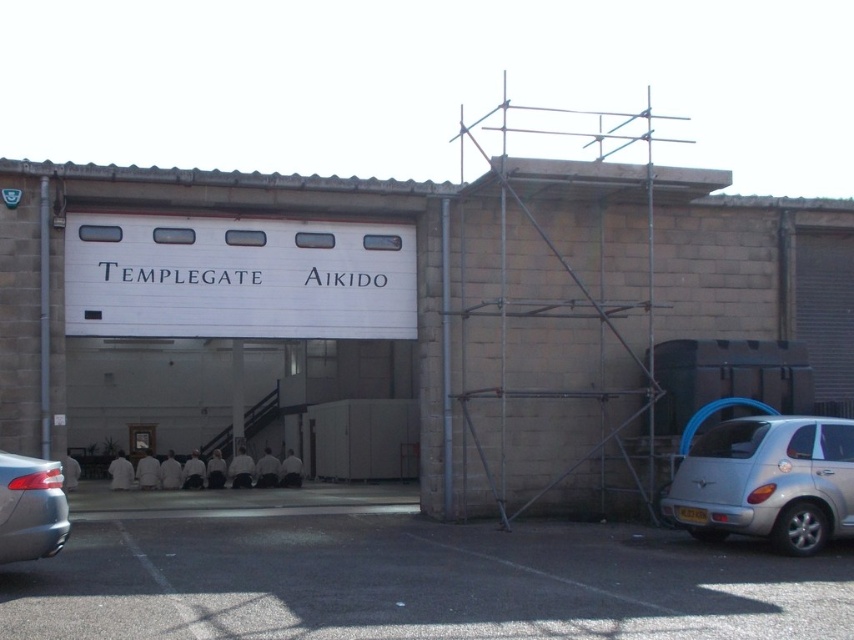
Based on the photo, between silver metallic car at lower right and metallic gray sedan at lower left, which one has less height?

Standing shorter between the two is metallic gray sedan at lower left.

Who is more distant from viewer, (717, 468) or (45, 522)?

The point (717, 468) is more distant.

Image resolution: width=854 pixels, height=640 pixels. Find the location of `silver metallic car at lower right`. silver metallic car at lower right is located at coordinates (767, 481).

Between black asphalt parking lot at lower center and silver metallic car at lower right, which one appears on the right side from the viewer's perspective?

Positioned to the right is silver metallic car at lower right.

Is black asphalt parking lot at lower center thinner than silver metallic car at lower right?

In fact, black asphalt parking lot at lower center might be wider than silver metallic car at lower right.

Which is behind, point (468, 566) or point (756, 531)?

Point (756, 531)

Image resolution: width=854 pixels, height=640 pixels. In order to click on black asphalt parking lot at lower center in this screenshot , I will do `click(407, 579)`.

From the picture: Does black asphalt parking lot at lower center appear on the left side of metallic gray sedan at lower left?

In fact, black asphalt parking lot at lower center is to the right of metallic gray sedan at lower left.

Is black asphalt parking lot at lower center further to camera compared to metallic gray sedan at lower left?

No, it is in front of metallic gray sedan at lower left.

Between point (215, 536) and point (34, 496), which one is positioned behind?

Point (215, 536)

The height and width of the screenshot is (640, 854). In order to click on black asphalt parking lot at lower center in this screenshot , I will do `click(407, 579)`.